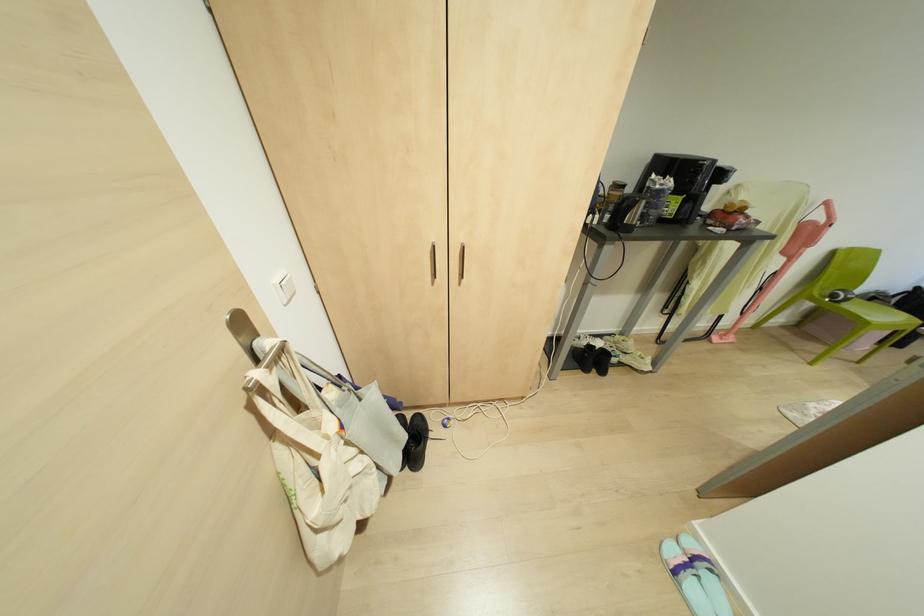
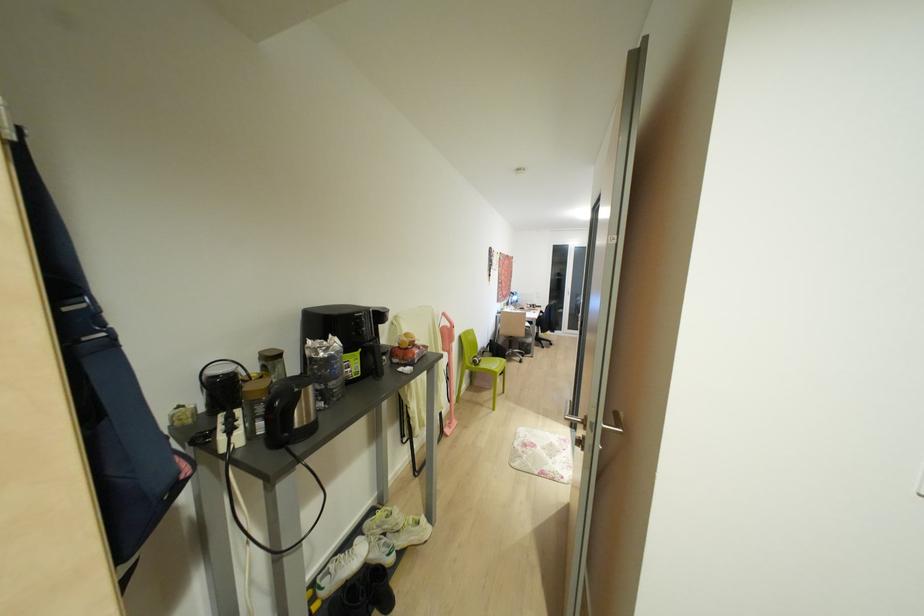
Question: Based on the continuous images, in which direction is the camera rotating? Reply with the corresponding letter.

Choices:
 (A) Left
 (B) Right
 (C) Up
 (D) Down

Answer: (B)